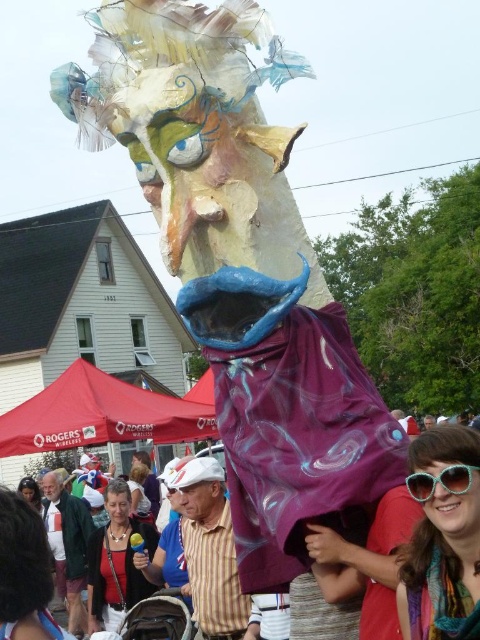
You are a photographer trying to capture both the metallic silver umbrella at center and the sunglasses at lower right in a single frame. Based on their positions, which object should you focus on first to ensure both are in the shot?

The metallic silver umbrella at center is below sunglasses at lower right, so you should focus on the sunglasses at lower right first to ensure both are in the frame.

You are standing in the middle of the parade route and see two points marked in the scene. Which point, point (420, 524) or point (416, 493), is closer to you?

Point (420, 524) is closer to you because it is further to the viewer than point (416, 493).